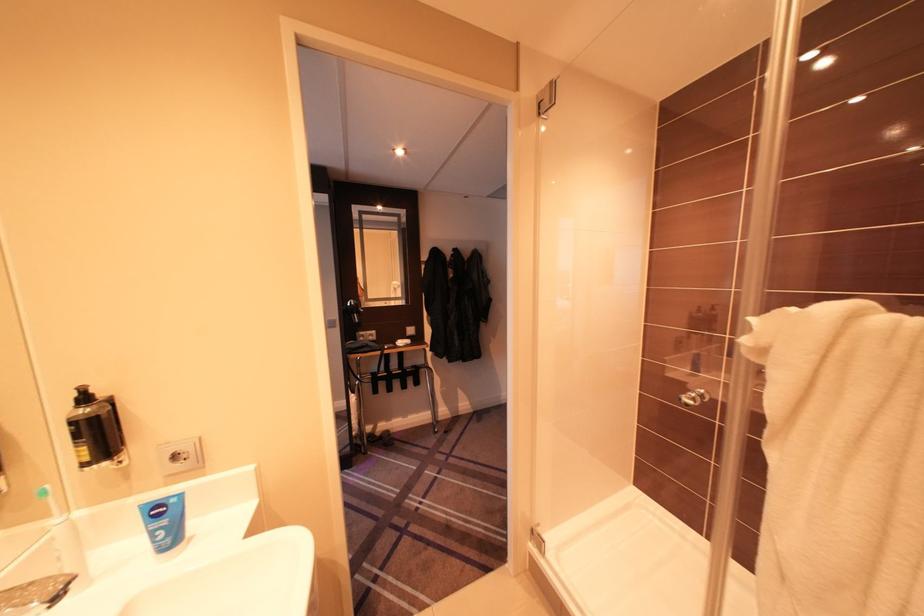
The height and width of the screenshot is (616, 924). In order to click on dispenser pump in this screenshot , I will do `click(83, 397)`.